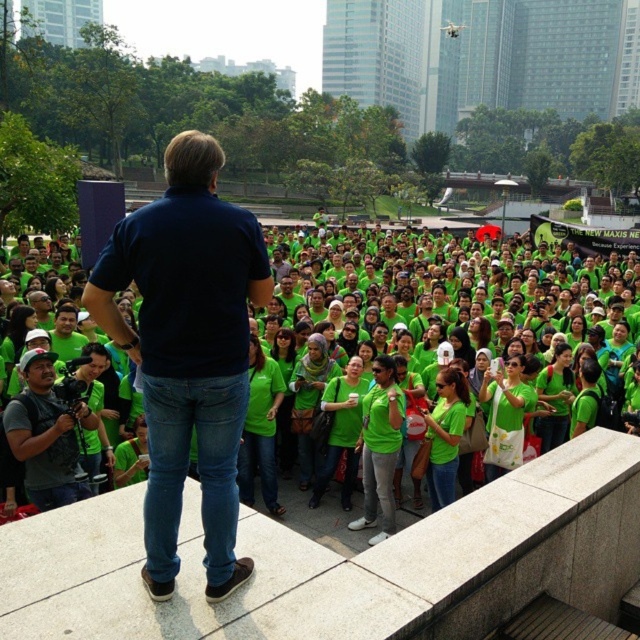
You are a photographer at the event and need to capture the crowd wearing green fabric shirts at center without the matte black camera at lower left blocking the view. Is the camera small enough to avoid obstructing the shot?

The green fabric shirts at center is larger in size than the matte black camera at lower left, so the camera is smaller and less likely to block the view of the shirts if positioned correctly.

You are a photographer attending an event in the park. You need to take a photo of the crowd wearing green fabric shirts at center without including the matte black camera at lower left in the frame. Based on their positions, is this possible?

The green fabric shirts at center are positioned to the right of the matte black camera at lower left. Therefore, by angling the camera to the right side of the scene, you can capture the green fabric shirts at center while excluding the matte black camera at lower left from the frame.